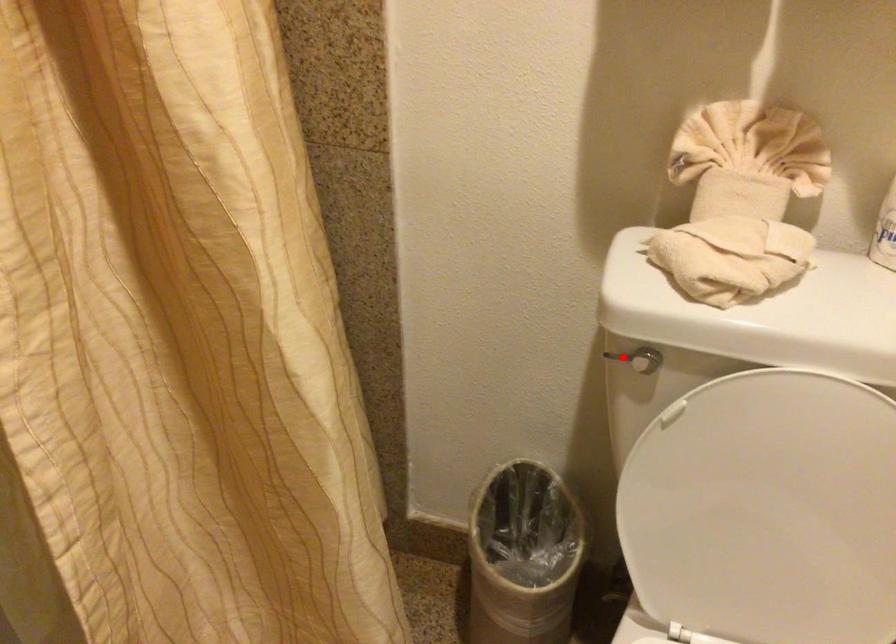
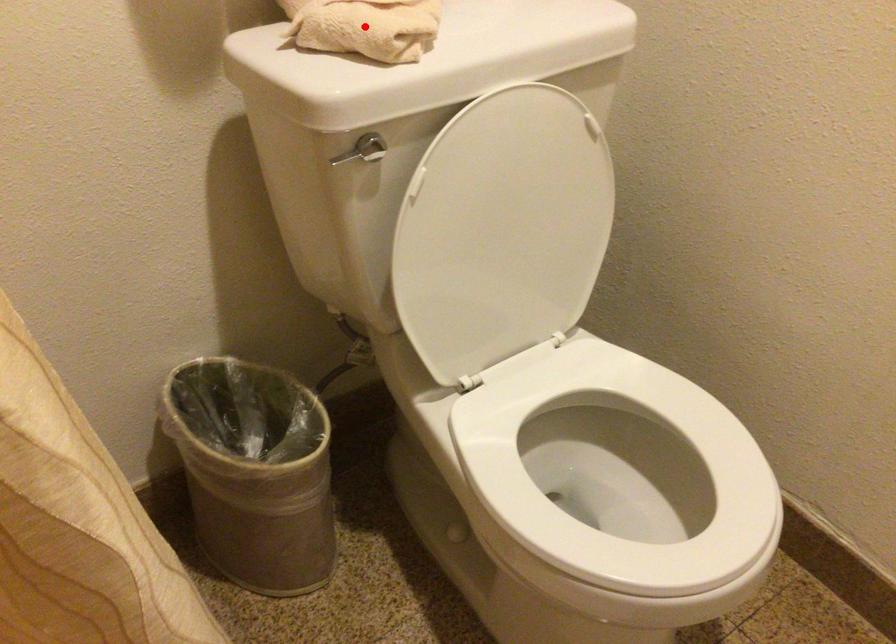
I am providing you with two images of the same scene from different viewpoints. A red point is marked on the first image and another point is marked on the second image. Is the marked point in image1 the same physical position as the marked point in image2?

No